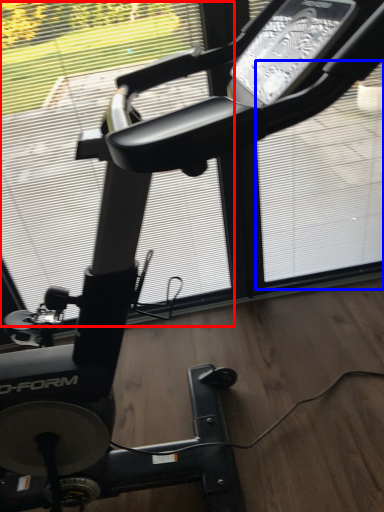
Question: Among these objects, which one is farthest to the camera, window screen (highlighted by a red box) or window screen (highlighted by a blue box)?

Choices:
 (A) window screen
 (B) window screen

Answer: (B)